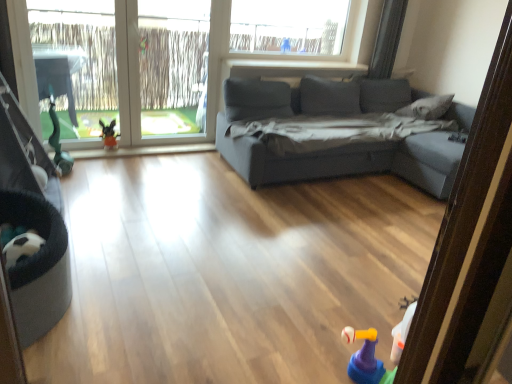
Question: From a real-world perspective, is rubberized yellow and purple toy at lower right positioned above or below clear glass window at left?

Choices:
 (A) above
 (B) below

Answer: (B)

Question: Considering the positions of rubberized yellow and purple toy at lower right and clear glass window at left in the image, is rubberized yellow and purple toy at lower right taller or shorter than clear glass window at left?

Choices:
 (A) tall
 (B) short

Answer: (B)

Question: Which of these objects is positioned farthest from the rubberized yellow and purple toy at lower right?

Choices:
 (A) black fabric baby carriage at lower left
 (B) clear glass window at left
 (C) transparent plastic window screen at upper center
 (D) gray fabric pillow at upper right
 (E) plush toy at lower left

Answer: (C)

Question: Which object is positioned farthest from the transparent plastic window screen at upper center?

Choices:
 (A) rubberized yellow and purple toy at lower right
 (B) black fabric baby carriage at lower left
 (C) gray fabric pillow at upper right
 (D) clear glass window at left
 (E) plush toy at lower left

Answer: (A)